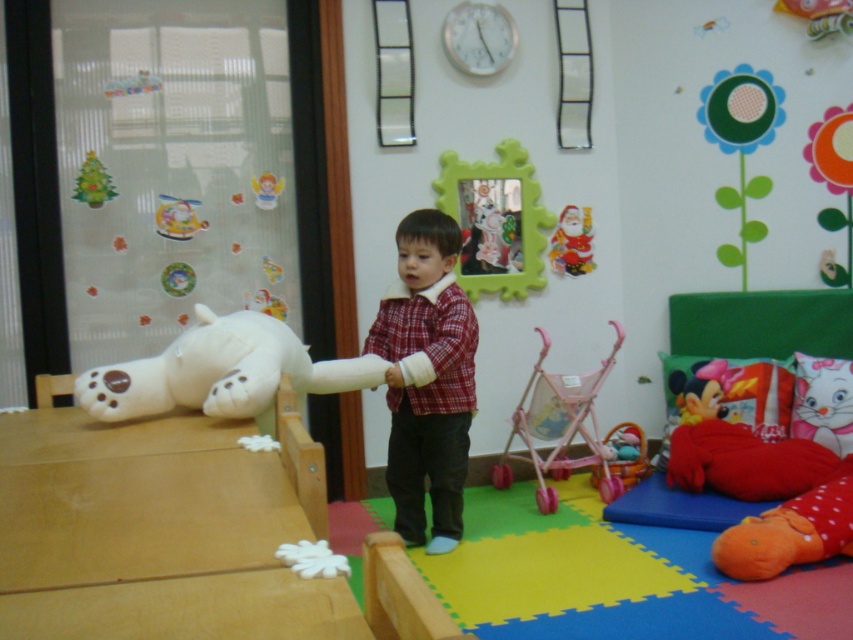
You are organizing a Christmas party in the playroom. You need to place the shiny red santa claus at upper center and the matte pink stroller at lower center. Which object requires more horizontal space when placing them side by side?

The matte pink stroller at lower center requires more horizontal space because it has a greater width than the shiny red santa claus at upper center.

Consider the image. You are standing at point (631,468) and want to reach the slide ramp in the playroom. There is a point (448,273) between you and the slide. Can you walk directly to the slide without going around?

Point (448,273) is in front of point (631,468), so the path to the slide is blocked by point (448,273). You will need to go around to reach the slide.

You are a parent trying to find your child in the playroom. You see the red plaid shirt at center and the white plush bear at left. Which object is taller?

The red plaid shirt at center is taller than the white plush bear at left.